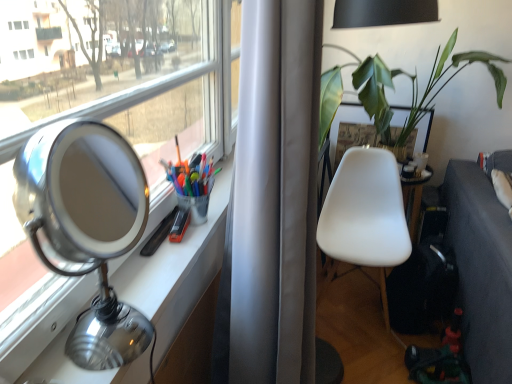
The height and width of the screenshot is (384, 512). In order to click on free space behind polished silver table lamp at left in this screenshot , I will do `click(137, 286)`.